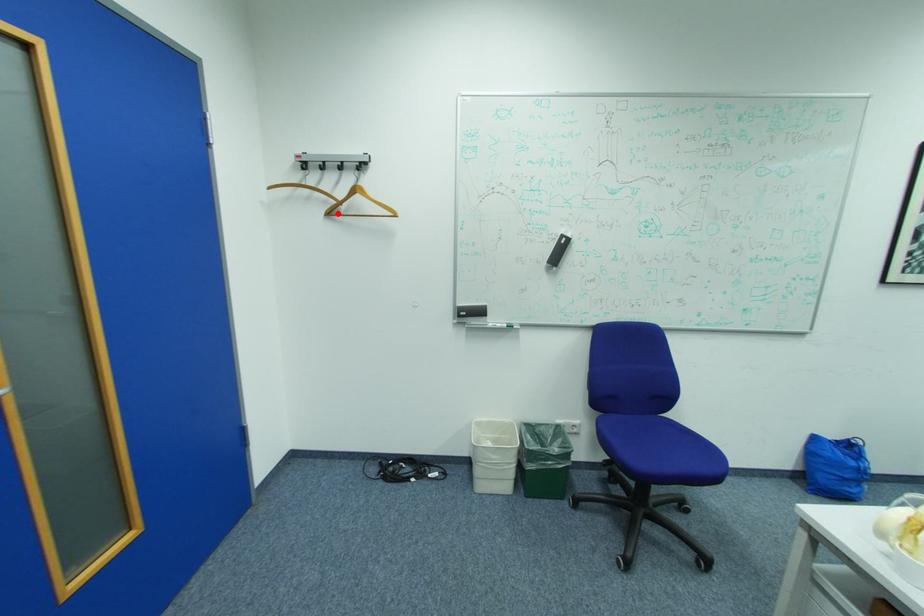
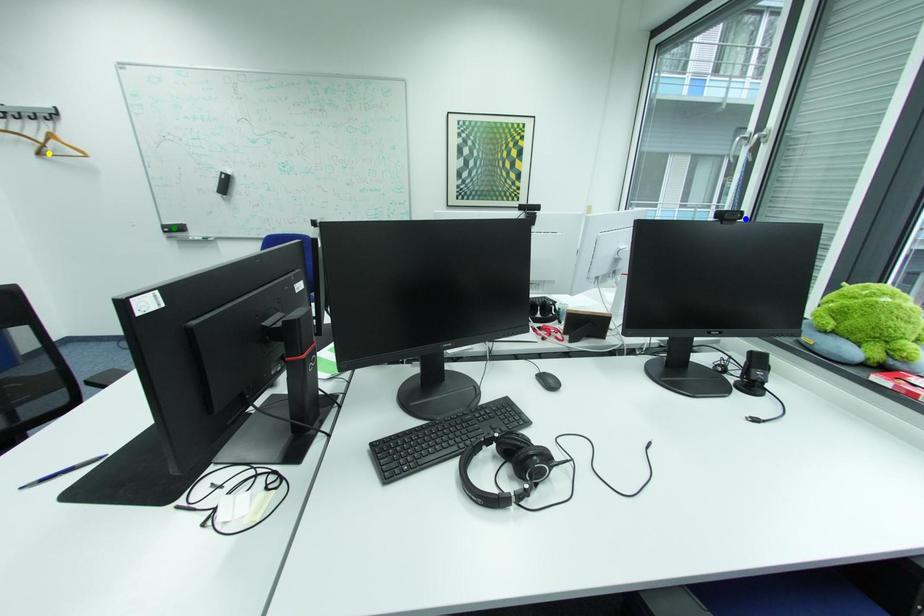
Question: I am providing you with two images of the same scene from different viewpoints. A red point is marked on the first image. You are given multiple points on the second image. Which mark in image 2 goes with the point in image 1?

Choices:
 (A) green point
 (B) blue point
 (C) yellow point

Answer: (C)